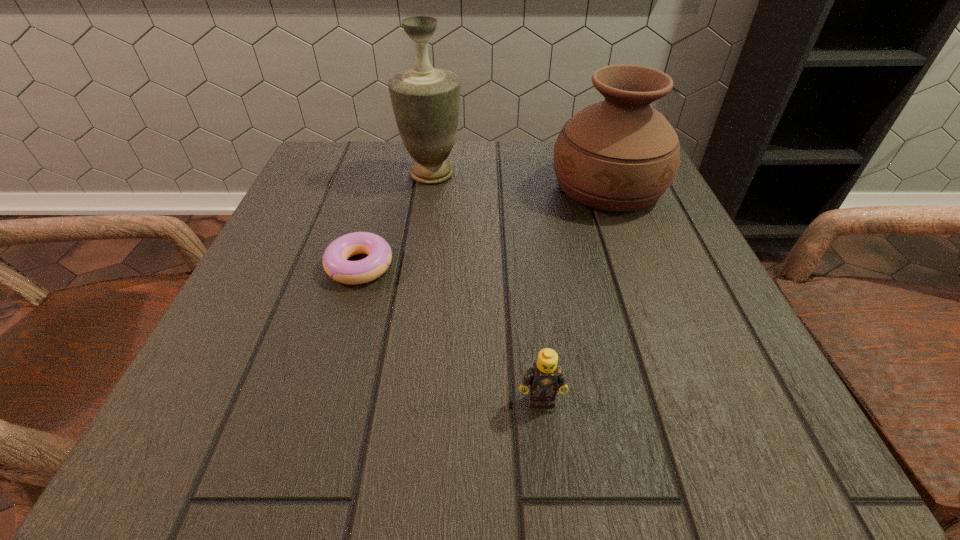
The height and width of the screenshot is (540, 960). In order to click on vacant space at the near left corner in this screenshot , I will do `click(226, 437)`.

In the image, there is a desktop. Where is `free space at the near right corner`? free space at the near right corner is located at coordinates (753, 401).

Where is `vacant region between the shortest object and the rightmost object`? vacant region between the shortest object and the rightmost object is located at coordinates (484, 226).

Locate an element on the screen. Image resolution: width=960 pixels, height=540 pixels. free space between the third tallest object and the second tallest object is located at coordinates (574, 293).

Find the location of `vacant space that's between the second object from right to left and the left urn`. vacant space that's between the second object from right to left and the left urn is located at coordinates (487, 287).

This screenshot has height=540, width=960. Identify the location of free space between the left urn and the shortest object. click(396, 220).

You are a GUI agent. You are given a task and a screenshot of the screen. Output one action in this format:
    pyautogui.click(x=<x>, y=<y>)
    Task: Click on the free point between the doughnut and the shorter urn
    
    Given the screenshot: What is the action you would take?
    pyautogui.click(x=484, y=226)

The image size is (960, 540). Find the location of `unoccupied position between the taller urn and the third tallest object`. unoccupied position between the taller urn and the third tallest object is located at coordinates click(x=487, y=287).

Find the location of a particular element. empty space between the second shortest object and the second tallest object is located at coordinates (574, 293).

Where is `empty space between the doughnut and the Lego`? This screenshot has height=540, width=960. empty space between the doughnut and the Lego is located at coordinates (450, 333).